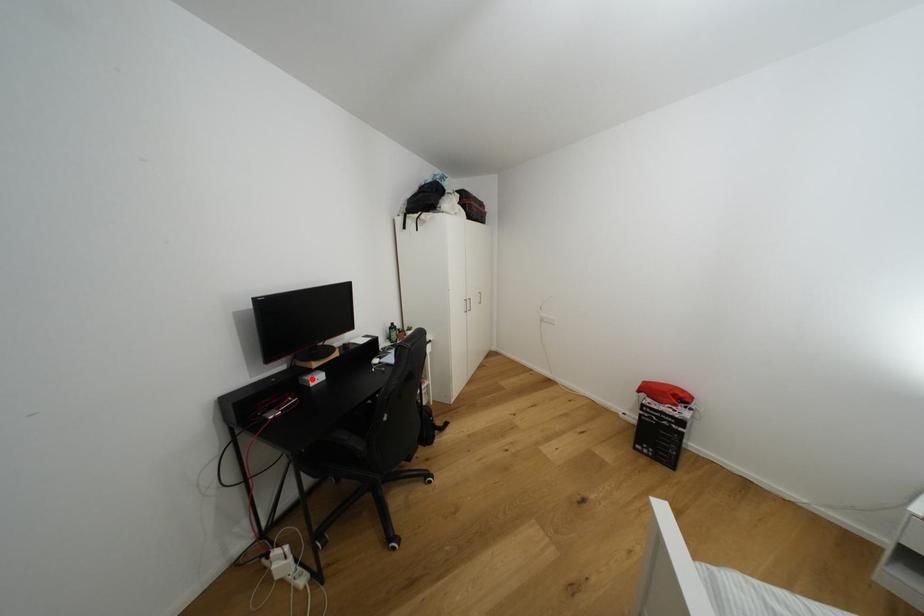
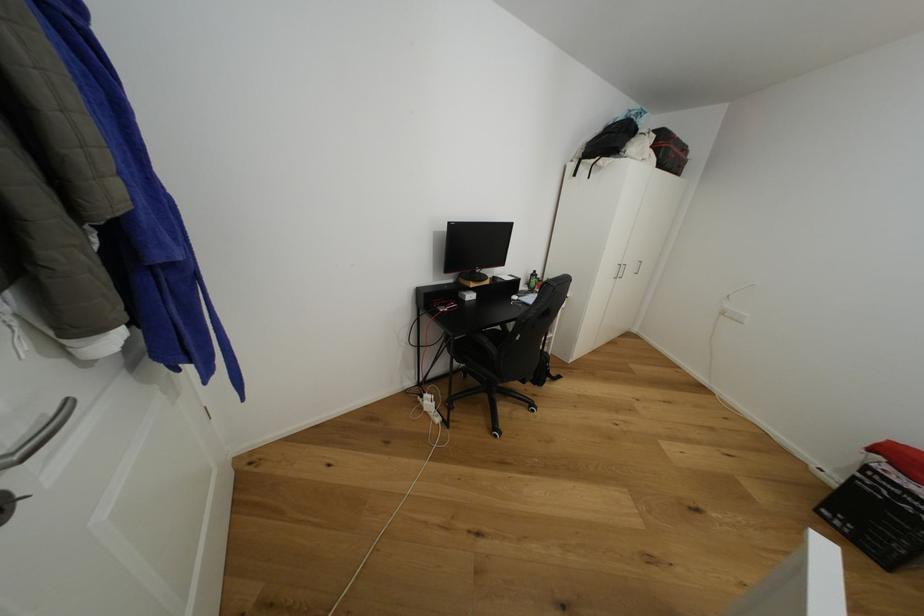
The point at the highlighted location is marked in the first image. Where is the corresponding point in the second image?

(469, 294)